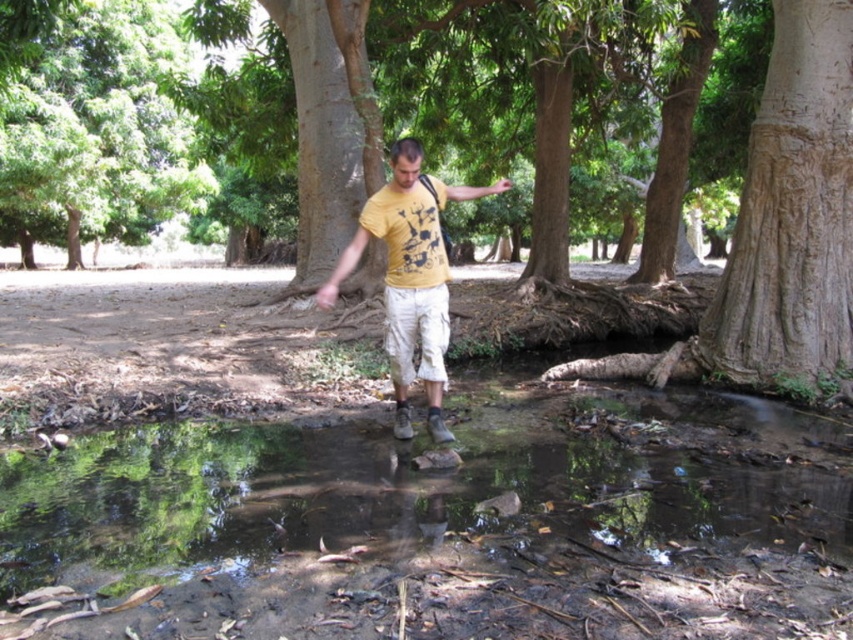
Looking at this image, you are a hiker trying to cross the stream shown in the image. There is a brown rough tree at center located at point (x=780, y=225). Can you safely step on it to cross the stream?

The brown rough tree at center located at point (x=780, y=225) is present in the scene, so yes, you can safely step on it to cross the stream.

You are a hiker who wants to cross the stream safely. The clear water at center is located at coordinates point 0.844, 0.494. Based on the scene description, where should you step to avoid the deeper parts of the stream?

The clear water at center is located at coordinates point (421, 540), so you should step where the clear water at center is located because clear water often indicates shallower areas where it is safer to cross.